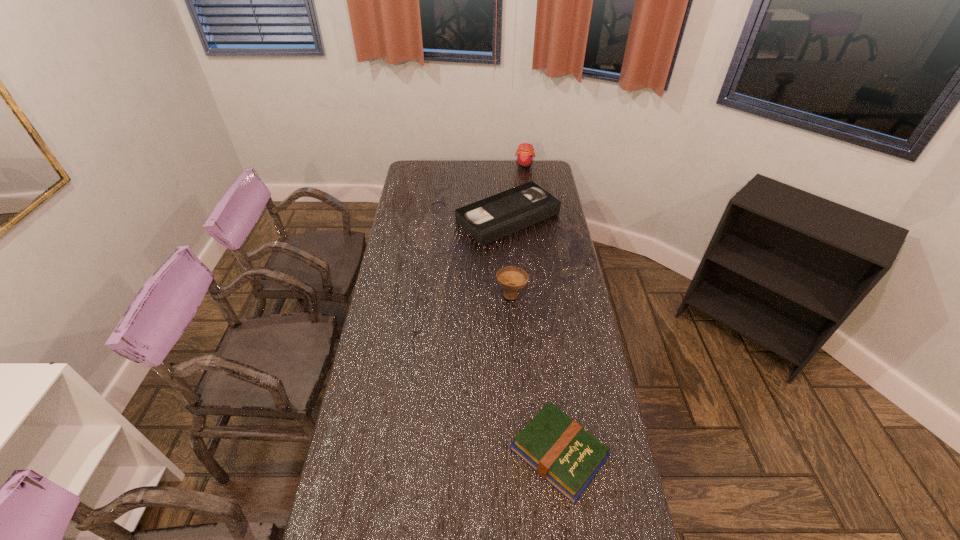
You are a GUI agent. You are given a task and a screenshot of the screen. Output one action in this format:
    pyautogui.click(x=<x>, y=<y>)
    Task: Click on the jam
    
    Given the screenshot: What is the action you would take?
    pyautogui.click(x=525, y=155)

The height and width of the screenshot is (540, 960). Identify the location of the third farthest object. (512, 279).

Identify the location of the second farthest object. (492, 218).

I want to click on book, so click(560, 450).

Locate an element on the screen. The image size is (960, 540). free space located 0.220m on the left of the farthest object is located at coordinates (475, 165).

The image size is (960, 540). In order to click on vacant region located 0.050m on the back of the soup bowl in this screenshot , I will do `click(510, 274)`.

Locate an element on the screen. vacant space positioned on the back of the videotape is located at coordinates (504, 166).

Where is `vacant point located 0.220m on the back of the book`? This screenshot has width=960, height=540. vacant point located 0.220m on the back of the book is located at coordinates (546, 351).

At what (x,y) coordinates should I click in order to perform the action: click on object that is positioned at the far edge. Please return your answer as a coordinate pair (x, y). Looking at the image, I should click on (525, 155).

Identify the location of jam located at the right edge. Image resolution: width=960 pixels, height=540 pixels. (525, 155).